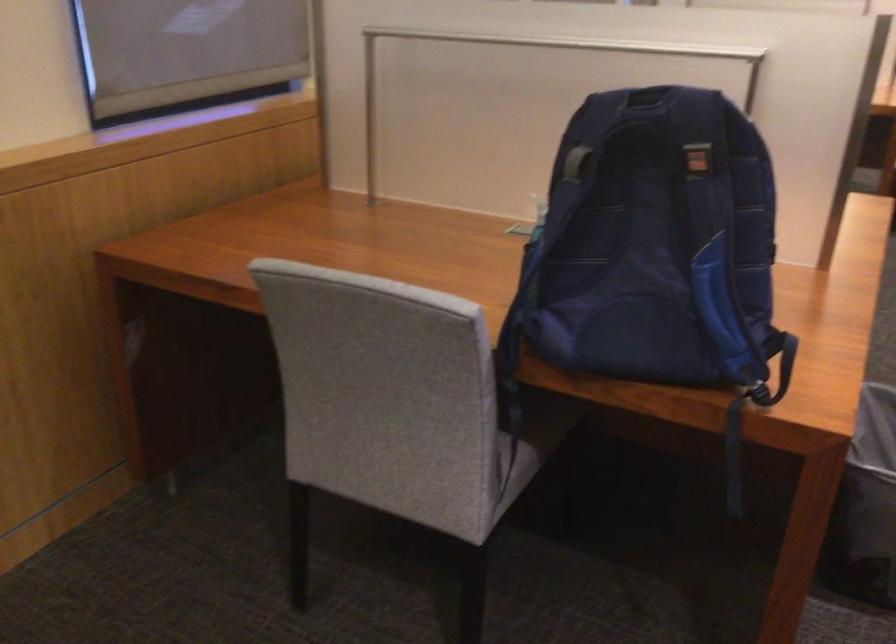
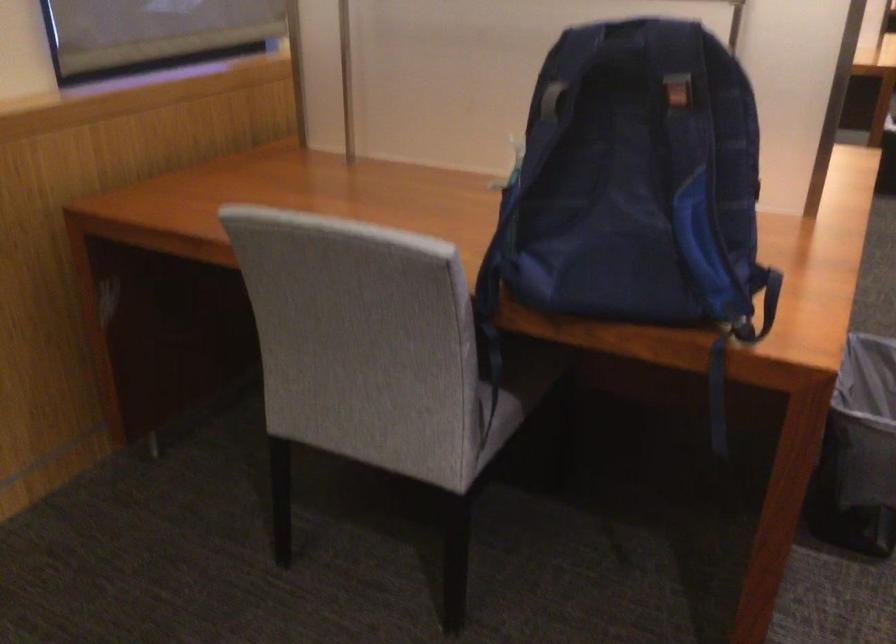
Question: The images are taken continuously from a first-person perspective. In which direction is your viewpoint rotating?

Choices:
 (A) Left
 (B) Right
 (C) Up
 (D) Down

Answer: (D)